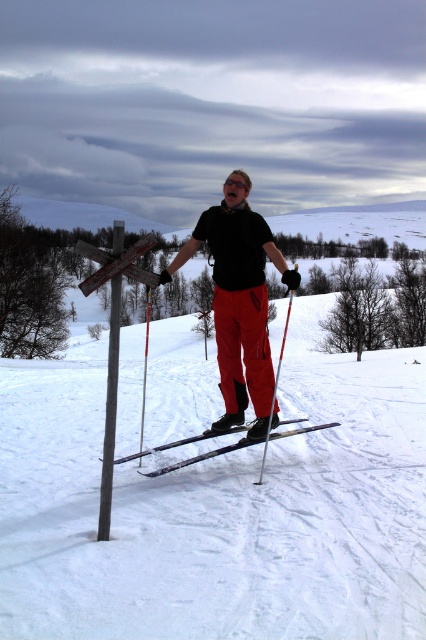
Question: Is matte black skis at center below matte red ski pole at center?

Choices:
 (A) no
 (B) yes

Answer: (A)

Question: Can you confirm if matte black skis at center is thinner than shiny metallic skis at center?

Choices:
 (A) yes
 (B) no

Answer: (A)

Question: Can you confirm if shiny metallic skis at center is positioned to the left of matte red ski pole at center?

Choices:
 (A) yes
 (B) no

Answer: (A)

Question: Among these points, which one is nearest to the camera?

Choices:
 (A) (279, 433)
 (B) (175, 614)
 (C) (227, 236)
 (D) (279, 365)

Answer: (B)

Question: Among these points, which one is nearest to the camera?

Choices:
 (A) (160, 468)
 (B) (273, 397)

Answer: (A)

Question: Based on their relative distances, which object is nearer to the white powder snow at center?

Choices:
 (A) matte black skis at center
 (B) shiny metallic skis at center

Answer: (B)